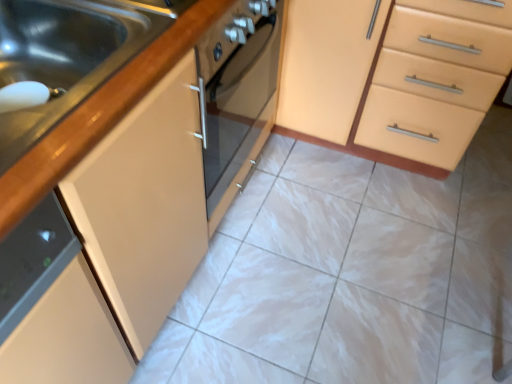
Question: Considering the relative sizes of matte beige cabinet at center and brushed metal sink at left in the image provided, is matte beige cabinet at center shorter than brushed metal sink at left?

Choices:
 (A) yes
 (B) no

Answer: (B)

Question: Would you say matte beige cabinet at center contains brushed metal sink at left?

Choices:
 (A) yes
 (B) no

Answer: (B)

Question: Is matte beige cabinet at center taller than brushed metal sink at left?

Choices:
 (A) yes
 (B) no

Answer: (A)

Question: From a real-world perspective, is matte beige cabinet at center beneath brushed metal sink at left?

Choices:
 (A) yes
 (B) no

Answer: (A)

Question: From the image's perspective, is matte beige cabinet at center located beneath brushed metal sink at left?

Choices:
 (A) yes
 (B) no

Answer: (B)

Question: From a real-world perspective, is matte beige cabinet at center positioned over brushed metal sink at left based on gravity?

Choices:
 (A) yes
 (B) no

Answer: (B)

Question: Is brushed metal sink at left aimed at matte beige cabinet at center?

Choices:
 (A) no
 (B) yes

Answer: (A)

Question: From the image's perspective, is brushed metal sink at left above matte beige cabinet at center?

Choices:
 (A) no
 (B) yes

Answer: (A)

Question: Considering the relative sizes of brushed metal sink at left and matte beige cabinet at center in the image provided, is brushed metal sink at left thinner than matte beige cabinet at center?

Choices:
 (A) yes
 (B) no

Answer: (A)

Question: Is brushed metal sink at left positioned behind matte beige cabinet at center?

Choices:
 (A) yes
 (B) no

Answer: (B)

Question: Does brushed metal sink at left have a greater width compared to matte beige cabinet at center?

Choices:
 (A) no
 (B) yes

Answer: (A)

Question: Can you confirm if brushed metal sink at left is bigger than matte beige cabinet at center?

Choices:
 (A) yes
 (B) no

Answer: (B)

Question: From the image's perspective, is matte beige cabinet at center above or below brushed metal sink at left?

Choices:
 (A) below
 (B) above

Answer: (B)